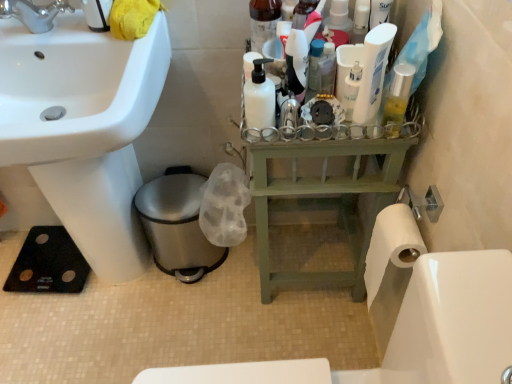
Based on the photo, measure the distance between point [439,271] and camera.

The depth of point [439,271] is 56.60 centimeters.

This screenshot has width=512, height=384. Find the location of `black rubber mat at lower left`. black rubber mat at lower left is located at coordinates coord(409,332).

Measure the distance between translucent plastic pump bottle at upper center, positioned as the first toiletry in left-to-right order, and camera.

The depth of translucent plastic pump bottle at upper center, positioned as the first toiletry in left-to-right order, is 91.20 centimeters.

You are a GUI agent. You are given a task and a screenshot of the screen. Output one action in this format:
    pyautogui.click(x=<x>, y=<y>)
    Task: Click on the white glossy sink at lower left
    Image resolution: width=512 pixels, height=384 pixels.
    Given the screenshot: What is the action you would take?
    pyautogui.click(x=84, y=129)

How much space does matte black bottle at center, arranged as the second toiletry when viewed from the left, occupy vertically?

matte black bottle at center, arranged as the second toiletry when viewed from the left, is 14.60 centimeters tall.

Locate an element on the screen. The width and height of the screenshot is (512, 384). white plastic tube at upper center is located at coordinates (373, 73).

Where is `green wood balustrade at center`? Image resolution: width=512 pixels, height=384 pixels. green wood balustrade at center is located at coordinates (324, 200).

Can you confirm if white glossy sink at lower left is bigger than white glossy lotion at center, which is the 3th toiletry in left-to-right order?

Yes.

How different are the orientations of white glossy sink at lower left and white glossy lotion at center, which is the 3th toiletry in left-to-right order, in degrees?

The facing directions of white glossy sink at lower left and white glossy lotion at center, which is the 3th toiletry in left-to-right order, are 90.1 degrees apart.

From the image's perspective, count 1st toiletrys upward from the white glossy sink at lower left and point to it. Please provide its 2D coordinates.

[(351, 89)]

Considering the relative positions of white glossy sink at lower left and white glossy lotion at center, marked as the 1th toiletry in a right-to-left arrangement, in the image provided, is white glossy sink at lower left to the right of white glossy lotion at center, marked as the 1th toiletry in a right-to-left arrangement, from the viewer's perspective?

In fact, white glossy sink at lower left is to the left of white glossy lotion at center, marked as the 1th toiletry in a right-to-left arrangement.

Is white plastic tube at upper center surrounded by white glossy sink at lower left?

No, white plastic tube at upper center is not inside white glossy sink at lower left.

Could you tell me if white glossy sink at lower left is turned towards white plastic tube at upper center?

No.

From the image's perspective, which is below, white glossy sink at lower left or white plastic tube at upper center?

white glossy sink at lower left is shown below in the image.

Considering the sizes of objects white glossy sink at lower left and white plastic tube at upper center in the image provided, who is smaller, white glossy sink at lower left or white plastic tube at upper center?

Smaller between the two is white plastic tube at upper center.

How much distance is there between matte black bottle at center, arranged as the second toiletry when viewed from the left, and white glossy lotion at center, marked as the 1th toiletry in a right-to-left arrangement?

matte black bottle at center, arranged as the second toiletry when viewed from the left, is 4.36 inches away from white glossy lotion at center, marked as the 1th toiletry in a right-to-left arrangement.

From a real-world perspective, is matte black bottle at center, arranged as the second toiletry when viewed from the left, located beneath white glossy lotion at center, which is the 3th toiletry in left-to-right order?

No, from a real-world perspective, matte black bottle at center, arranged as the second toiletry when viewed from the left, is not below white glossy lotion at center, which is the 3th toiletry in left-to-right order.

Is white glossy lotion at center, marked as the 1th toiletry in a right-to-left arrangement, a part of matte black bottle at center, arranged as the second toiletry when viewed from the left?

Definitely not — white glossy lotion at center, marked as the 1th toiletry in a right-to-left arrangement, is not inside matte black bottle at center, arranged as the second toiletry when viewed from the left.

From the image's perspective, count 1st toiletrys upward from the white glossy lotion at center, marked as the 1th toiletry in a right-to-left arrangement, and point to it. Please provide its 2D coordinates.

[(297, 62)]

From a real-world perspective, between black rubber mat at lower left and green wood balustrade at center, who is vertically higher?

black rubber mat at lower left, from a real-world perspective.

From the picture: Which object is more forward, black rubber mat at lower left or green wood balustrade at center?

black rubber mat at lower left is closer to the camera.

Is green wood balustrade at center at the back of black rubber mat at lower left?

No, black rubber mat at lower left is not facing away from green wood balustrade at center.

Is white glossy lotion at center, which is the 3th toiletry in left-to-right order, far from black rubber mat at lower left?

No, white glossy lotion at center, which is the 3th toiletry in left-to-right order, is not far from black rubber mat at lower left.

Can you tell me how much white glossy lotion at center, marked as the 1th toiletry in a right-to-left arrangement, and black rubber mat at lower left differ in facing direction?

1.33 degrees.

Between white glossy lotion at center, marked as the 1th toiletry in a right-to-left arrangement, and black rubber mat at lower left, which one has larger size?

Bigger between the two is black rubber mat at lower left.

The width and height of the screenshot is (512, 384). In order to click on toiletry that is the 2nd one when counting rightward from the black rubber mat at lower left in this screenshot , I will do `click(351, 89)`.

Is white plastic tube at upper center wider than translucent plastic pump bottle at upper center, positioned as the first toiletry in left-to-right order?

No, white plastic tube at upper center is not wider than translucent plastic pump bottle at upper center, positioned as the first toiletry in left-to-right order.

Is white plastic tube at upper center behind translucent plastic pump bottle at upper center, which appears as the third toiletry when viewed from the right?

No, white plastic tube at upper center is closer to the viewer.

The image size is (512, 384). In order to click on cleaning product above the translucent plastic pump bottle at upper center, which appears as the third toiletry when viewed from the right (from a real-world perspective) in this screenshot , I will do `click(373, 73)`.

Looking at this image, from the image's perspective, is white plastic tube at upper center on top of translucent plastic pump bottle at upper center, positioned as the first toiletry in left-to-right order?

No, from the image's perspective, white plastic tube at upper center is not on top of translucent plastic pump bottle at upper center, positioned as the first toiletry in left-to-right order.

Considering the sizes of objects white plastic tube at upper center and black rubber mat at lower left in the image provided, who is smaller, white plastic tube at upper center or black rubber mat at lower left?

white plastic tube at upper center is smaller.

Is white plastic tube at upper center thinner than black rubber mat at lower left?

Correct, the width of white plastic tube at upper center is less than that of black rubber mat at lower left.

From a real-world perspective, is white plastic tube at upper center on black rubber mat at lower left?

Yes.

Is white plastic tube at upper center touching black rubber mat at lower left?

No, white plastic tube at upper center is not next to black rubber mat at lower left.

I want to click on sink that is in front of the white glossy lotion at center, marked as the 1th toiletry in a right-to-left arrangement, so click(84, 129).

At what (x,y) coordinates should I click in order to perform the action: click on cleaning product above the white glossy sink at lower left (from the image's perspective). Please return your answer as a coordinate pair (x, y). Image resolution: width=512 pixels, height=384 pixels. Looking at the image, I should click on (373, 73).

Estimate the real-world distances between objects in this image. Which object is closer to black rubber mat at lower left, white glossy sink at lower left or white glossy lotion at center, marked as the 1th toiletry in a right-to-left arrangement?

white glossy lotion at center, marked as the 1th toiletry in a right-to-left arrangement.

From the image, which object appears to be farther from white glossy lotion at center, marked as the 1th toiletry in a right-to-left arrangement, white matte bottle at center or white plastic tube at upper center?

white matte bottle at center is positioned further to the anchor white glossy lotion at center, marked as the 1th toiletry in a right-to-left arrangement.

When comparing their distances from black rubber mat at lower left, does green wood balustrade at center or white matte bottle at center seem further?

white matte bottle at center is positioned further to the anchor black rubber mat at lower left.

Considering their positions, is white glossy lotion at center, which is the 3th toiletry in left-to-right order, positioned further to matte black bottle at center, the second toiletry in the right-to-left sequence, than white matte bottle at center?

white glossy lotion at center, which is the 3th toiletry in left-to-right order, is further to matte black bottle at center, the second toiletry in the right-to-left sequence.

From the image, which object appears to be nearer to white matte bottle at center, white glossy sink at lower left or white plastic tube at upper center?

The object closer to white matte bottle at center is white plastic tube at upper center.

Which object lies nearer to the anchor point translucent plastic pump bottle at upper center, which appears as the third toiletry when viewed from the right, white matte bottle at center or white glossy sink at lower left?

white matte bottle at center lies closer to translucent plastic pump bottle at upper center, which appears as the third toiletry when viewed from the right, than the other object.

Based on their spatial positions, is white glossy sink at lower left or green wood balustrade at center further from matte black bottle at center, the second toiletry in the right-to-left sequence?

white glossy sink at lower left is positioned further to the anchor matte black bottle at center, the second toiletry in the right-to-left sequence.

Looking at the image, which one is located closer to green wood balustrade at center, black rubber mat at lower left or white matte bottle at center?

white matte bottle at center is closer to green wood balustrade at center.

At what (x,y) coordinates should I click in order to perform the action: click on balustrade that lies between white glossy lotion at center, which is the 3th toiletry in left-to-right order, and black rubber mat at lower left from top to bottom. Please return your answer as a coordinate pair (x, y). The image size is (512, 384). Looking at the image, I should click on pyautogui.click(x=324, y=200).

Identify the location of bath between white glossy sink at lower left and white glossy lotion at center, marked as the 1th toiletry in a right-to-left arrangement, in the horizontal direction. (409, 332).

In order to click on mouthwash located between white glossy sink at lower left and green wood balustrade at center in the left-right direction in this screenshot , I will do `click(259, 101)`.

This screenshot has width=512, height=384. I want to click on mouthwash located between white glossy sink at lower left and white plastic tube at upper center in the left-right direction, so click(x=259, y=101).